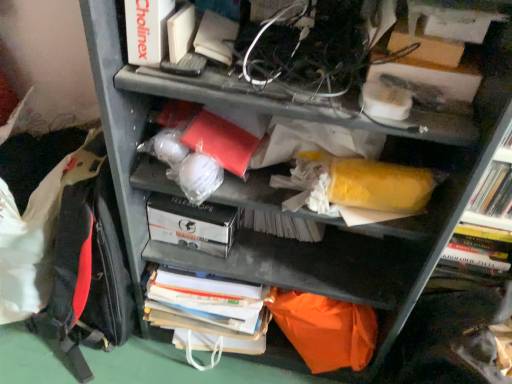
Question: Is yellow matte bookshelf at right a part of red fabric backpack at left?

Choices:
 (A) no
 (B) yes

Answer: (A)

Question: Does red fabric backpack at left lie behind yellow matte bookshelf at right?

Choices:
 (A) no
 (B) yes

Answer: (A)

Question: Considering the relative sizes of red fabric backpack at left and yellow matte bookshelf at right in the image provided, is red fabric backpack at left shorter than yellow matte bookshelf at right?

Choices:
 (A) no
 (B) yes

Answer: (A)

Question: Is red fabric backpack at left positioned with its back to yellow matte bookshelf at right?

Choices:
 (A) yes
 (B) no

Answer: (B)

Question: Considering the relative sizes of red fabric backpack at left and yellow matte bookshelf at right in the image provided, is red fabric backpack at left thinner than yellow matte bookshelf at right?

Choices:
 (A) no
 (B) yes

Answer: (A)

Question: Is yellow matte bookshelf at right wider or thinner than red fabric backpack at left?

Choices:
 (A) thin
 (B) wide

Answer: (A)

Question: Does point (486, 173) appear closer or farther from the camera than point (80, 157)?

Choices:
 (A) farther
 (B) closer

Answer: (B)

Question: In terms of height, does yellow matte bookshelf at right look taller or shorter compared to red fabric backpack at left?

Choices:
 (A) tall
 (B) short

Answer: (B)

Question: In terms of size, does yellow matte bookshelf at right appear bigger or smaller than red fabric backpack at left?

Choices:
 (A) small
 (B) big

Answer: (A)

Question: Considering the positions of white cardboard box at center, arranged as the second paperback book when viewed from the top, and red fabric backpack at left in the image, is white cardboard box at center, arranged as the second paperback book when viewed from the top, taller or shorter than red fabric backpack at left?

Choices:
 (A) tall
 (B) short

Answer: (B)

Question: In the image, is white cardboard box at center, acting as the first paperback book starting from the back, on the left side or the right side of red fabric backpack at left?

Choices:
 (A) left
 (B) right

Answer: (B)

Question: In terms of size, does white cardboard box at center, arranged as the second paperback book when viewed from the top, appear bigger or smaller than red fabric backpack at left?

Choices:
 (A) small
 (B) big

Answer: (A)

Question: Considering the positions of white cardboard box at center, acting as the first paperback book starting from the back, and red fabric backpack at left in the image, is white cardboard box at center, acting as the first paperback book starting from the back, wider or thinner than red fabric backpack at left?

Choices:
 (A) wide
 (B) thin

Answer: (B)

Question: Does point (146, 26) appear closer or farther from the camera than point (76, 233)?

Choices:
 (A) farther
 (B) closer

Answer: (B)

Question: In the image, is white matte book at upper left, positioned as the second paperback book in bottom-to-top order, on the left side or the right side of red fabric backpack at left?

Choices:
 (A) left
 (B) right

Answer: (B)